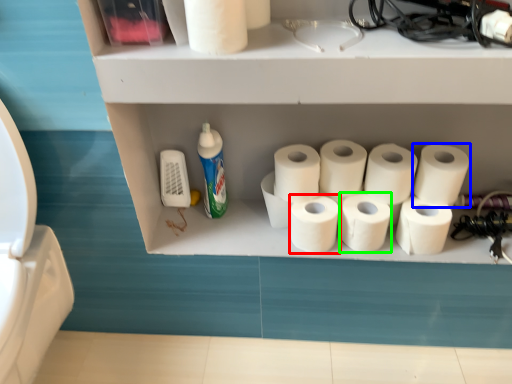
Question: Based on their relative distances, which object is farther from toilet paper (highlighted by a red box)? Choose from toilet paper (highlighted by a blue box) and toilet paper (highlighted by a green box).

Choices:
 (A) toilet paper
 (B) toilet paper

Answer: (A)